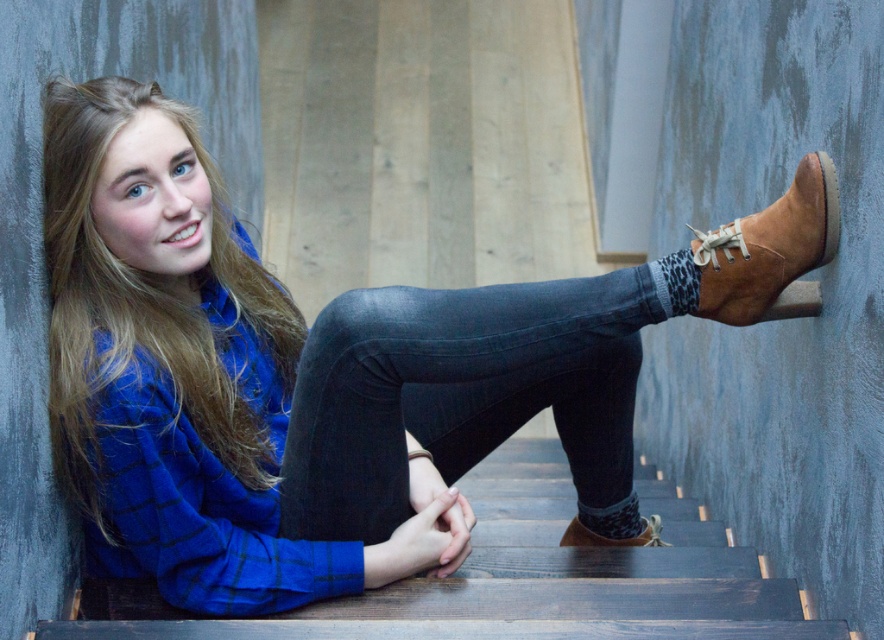
You are a photographer setting up a shoot in the scene. You need to place a small prop between the dark gray denim jeans at center and the brown suede boot at upper right. Based on their positions, where should you place the prop to ensure it is visible in the frame?

The prop should be placed between the dark gray denim jeans at center and the brown suede boot at upper right, closer to the dark gray denim jeans at center since it is in front of the brown suede boot at upper right, ensuring visibility.

You are standing in front of the staircase where the woman is sitting. You notice two points marked in the image. Which point is closer to you, point (768, 236) or point (588, 541)?

Point (768, 236) is closer to the camera than point (588, 541).